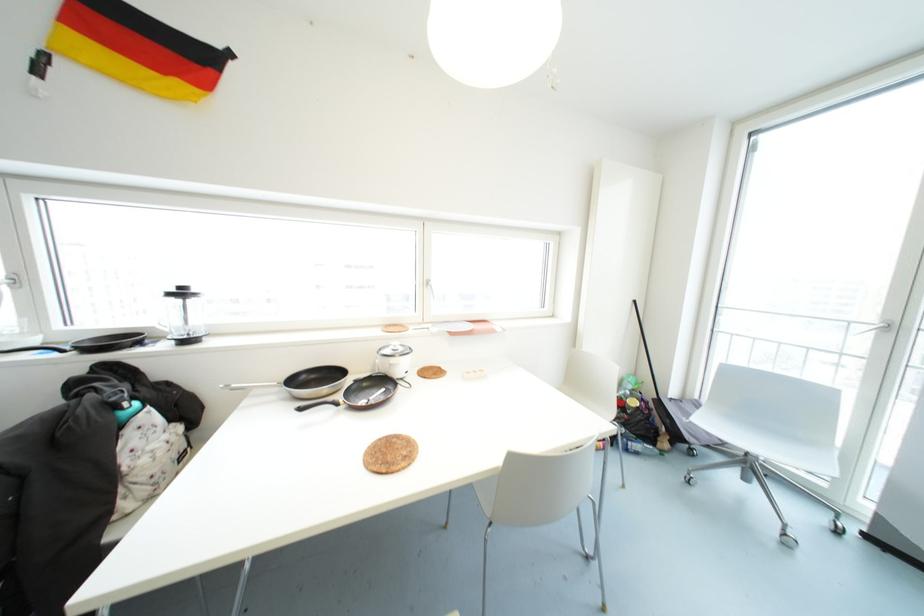
This screenshot has width=924, height=616. Describe the element at coordinates (649, 363) in the screenshot. I see `the black broom handle` at that location.